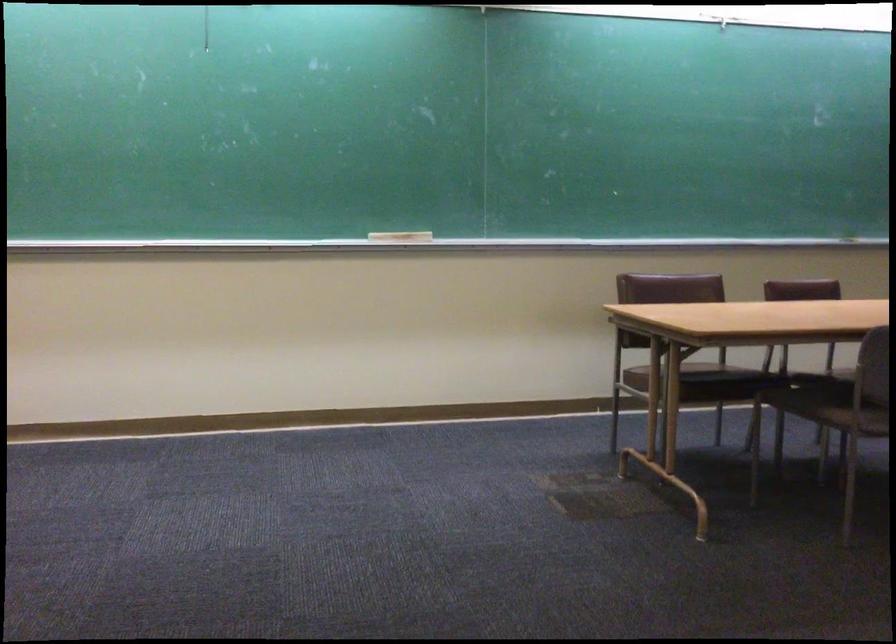
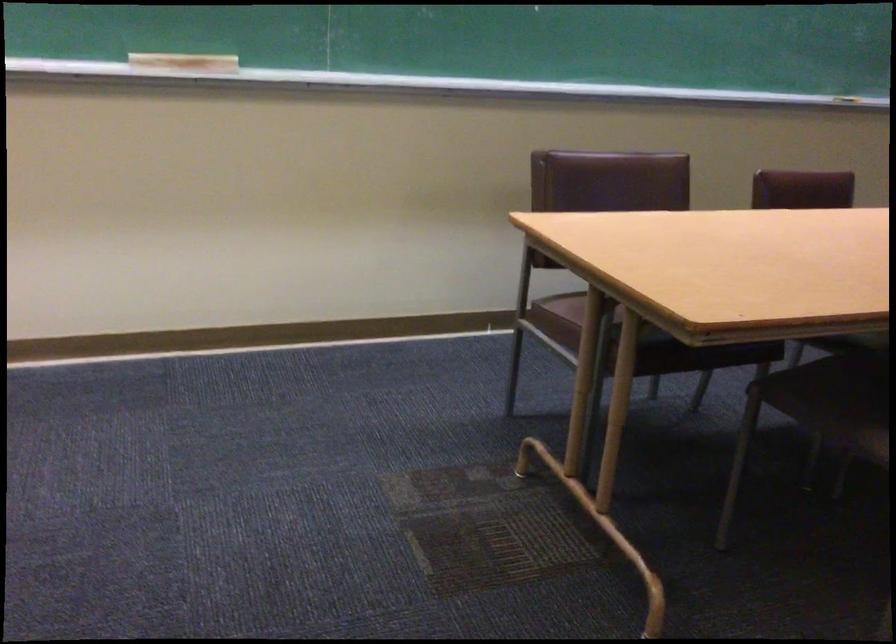
Where in the second image is the point corresponding to point (814, 397) from the first image?

(833, 391)